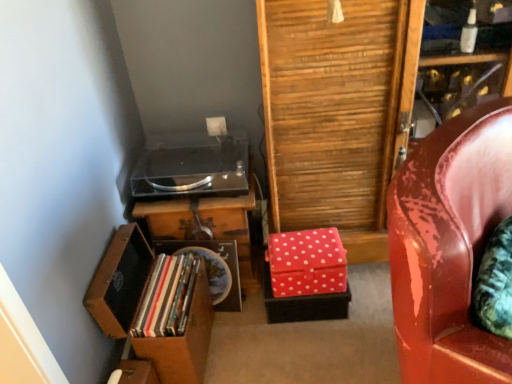
Question: From the image's perspective, is matte plastic books at lower left over transparent acrylic stereo at center?

Choices:
 (A) no
 (B) yes

Answer: (A)

Question: Considering the relative sizes of matte plastic books at lower left and transparent acrylic stereo at center in the image provided, is matte plastic books at lower left thinner than transparent acrylic stereo at center?

Choices:
 (A) yes
 (B) no

Answer: (A)

Question: From a real-world perspective, does matte plastic books at lower left sit lower than transparent acrylic stereo at center?

Choices:
 (A) yes
 (B) no

Answer: (A)

Question: Is matte plastic books at lower left located outside transparent acrylic stereo at center?

Choices:
 (A) yes
 (B) no

Answer: (A)

Question: Can you see matte plastic books at lower left touching transparent acrylic stereo at center?

Choices:
 (A) yes
 (B) no

Answer: (B)

Question: Can you confirm if matte plastic books at lower left is positioned to the right of transparent acrylic stereo at center?

Choices:
 (A) yes
 (B) no

Answer: (B)

Question: From the image's perspective, is matte plastic books at lower left beneath wooden table at center?

Choices:
 (A) no
 (B) yes

Answer: (B)

Question: From the image's perspective, would you say matte plastic books at lower left is positioned over wooden table at center?

Choices:
 (A) no
 (B) yes

Answer: (A)

Question: Is wooden table at center surrounded by matte plastic books at lower left?

Choices:
 (A) yes
 (B) no

Answer: (B)

Question: Considering the relative sizes of matte plastic books at lower left and wooden table at center in the image provided, is matte plastic books at lower left bigger than wooden table at center?

Choices:
 (A) yes
 (B) no

Answer: (B)

Question: From a real-world perspective, is matte plastic books at lower left physically above wooden table at center?

Choices:
 (A) yes
 (B) no

Answer: (A)

Question: Is matte plastic books at lower left taller than wooden table at center?

Choices:
 (A) yes
 (B) no

Answer: (B)

Question: Is wooden table at center positioned with its back to matte plastic books at lower left?

Choices:
 (A) no
 (B) yes

Answer: (A)